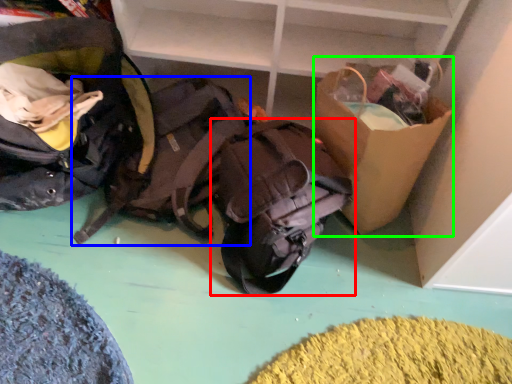
Question: Estimate the real-world distances between objects in this image. Which object is closer to backpack (highlighted by a red box), backpack (highlighted by a blue box) or cardboard box (highlighted by a green box)?

Choices:
 (A) backpack
 (B) cardboard box

Answer: (B)